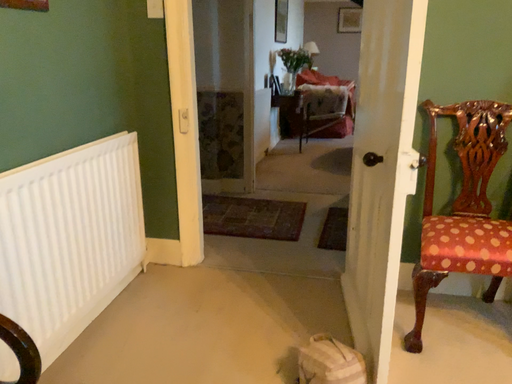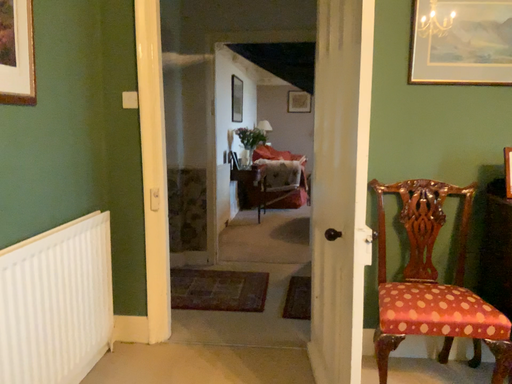
Question: How did the camera likely rotate when shooting the video?

Choices:
 (A) rotated downward
 (B) rotated upward

Answer: (B)